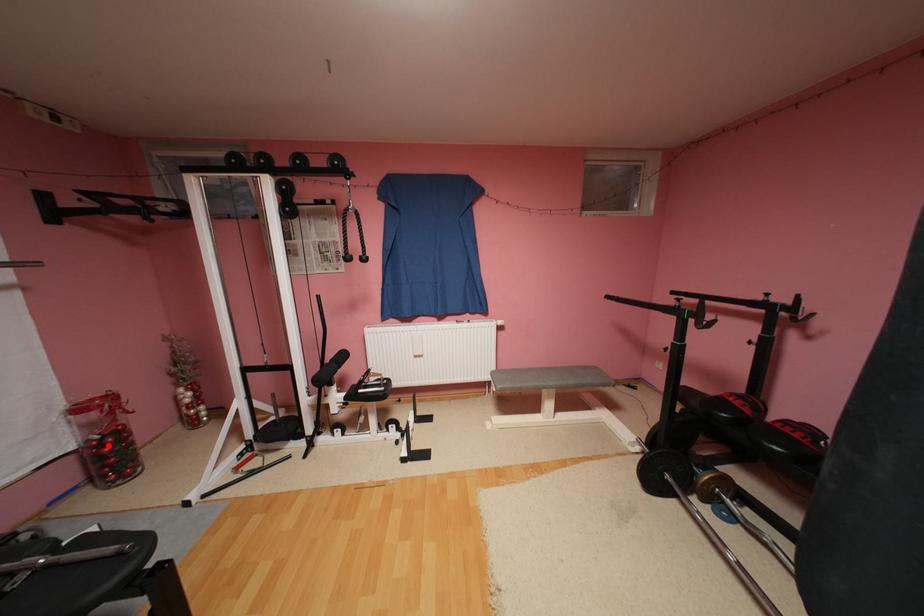
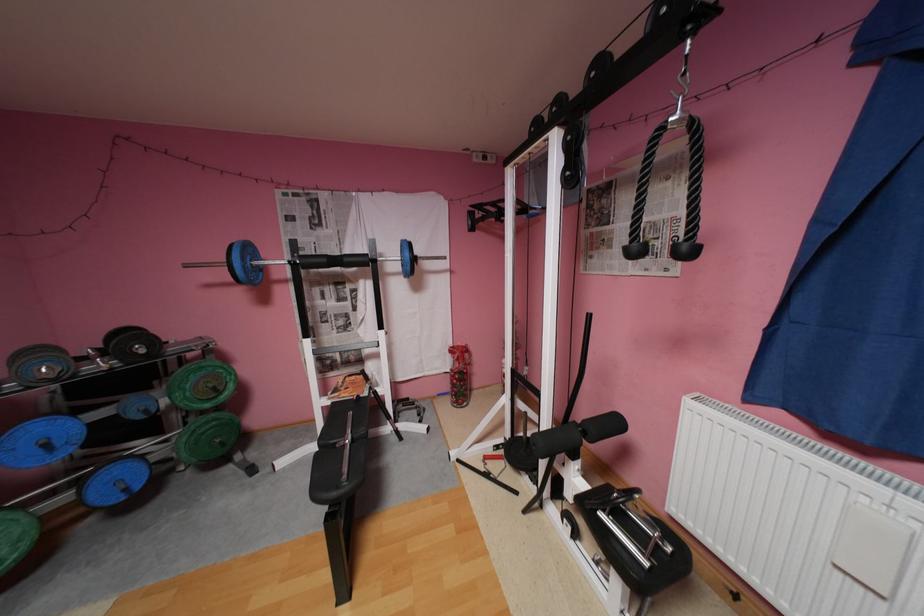
Question: I am providing you with two images of the same scene from different viewpoints. A red point is shown in image1. For the corresponding object point in image2, is it positioned nearer or farther from the camera?

Choices:
 (A) Nearer
 (B) Farther

Answer: (B)